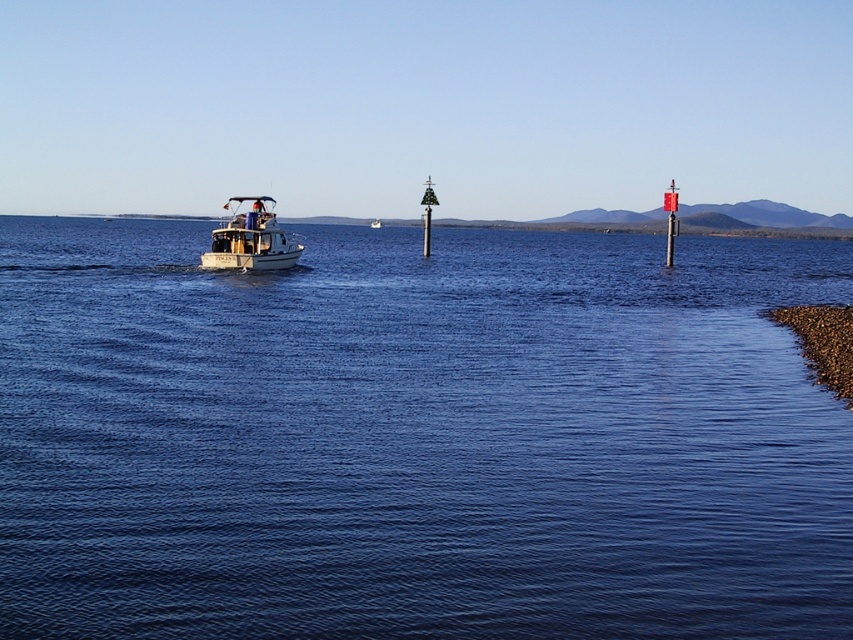
In the scene shown: What is the 2D coordinate of the blue water at center?

The 2D coordinate of the blue water at center is at point (416, 436).